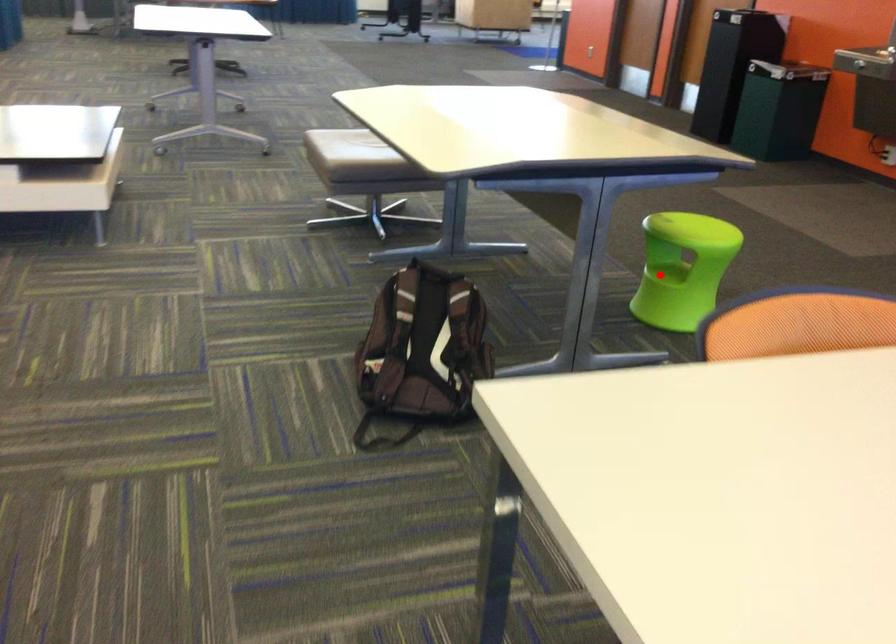
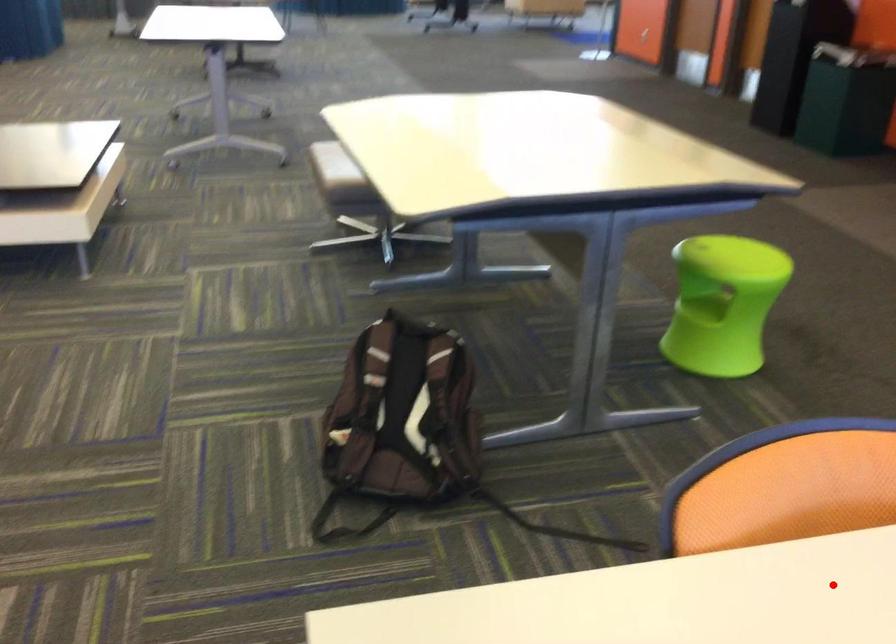
I am providing you with two images of the same scene from different viewpoints. A red point is marked on the first image and another point is marked on the second image. Does the point marked in image1 correspond to the same location as the one in image2?

No